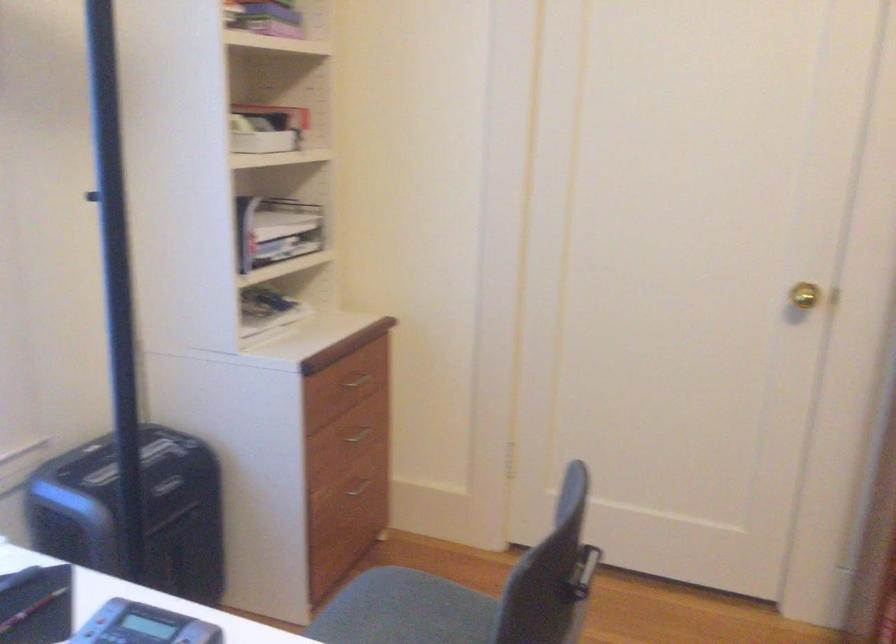
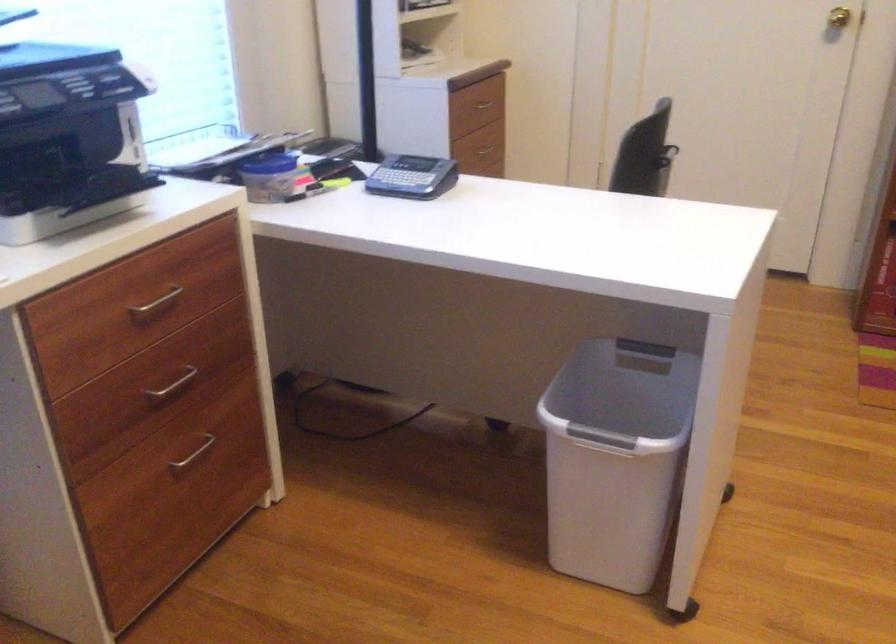
Question: I am providing you with two images of the same scene from different viewpoints. Please identify which objects are invisible in image2.

Choices:
 (A) brass doorknob
 (B) silver drawer handle
 (C) plastic bag of grains
 (D) drawer handle

Answer: (B)